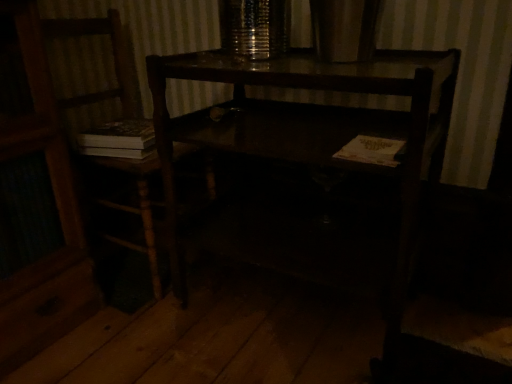
Question: Is wooden chair at left oriented away from white paper book at lower right?

Choices:
 (A) no
 (B) yes

Answer: (A)

Question: Is white paper book at lower right completely or partially inside wooden chair at left?

Choices:
 (A) yes
 (B) no

Answer: (B)

Question: From the image's perspective, is wooden chair at left over white paper book at lower right?

Choices:
 (A) no
 (B) yes

Answer: (B)

Question: Considering the relative positions of wooden chair at left and white paper book at lower right in the image provided, is wooden chair at left to the left of white paper book at lower right from the viewer's perspective?

Choices:
 (A) no
 (B) yes

Answer: (B)

Question: Is wooden chair at left touching white paper book at lower right?

Choices:
 (A) yes
 (B) no

Answer: (B)

Question: From a real-world perspective, does wooden chair at left stand above white paper book at lower right?

Choices:
 (A) no
 (B) yes

Answer: (A)

Question: From the image's perspective, would you say white paper book at lower right is shown under wooden chair at left?

Choices:
 (A) yes
 (B) no

Answer: (A)

Question: From a real-world perspective, is white paper book at lower right located higher than wooden chair at left?

Choices:
 (A) no
 (B) yes

Answer: (B)

Question: Is white paper book at lower right closer to the viewer compared to wooden chair at left?

Choices:
 (A) no
 (B) yes

Answer: (B)

Question: Does white paper book at lower right appear on the right side of wooden chair at left?

Choices:
 (A) no
 (B) yes

Answer: (B)

Question: Can you confirm if white paper book at lower right is bigger than wooden chair at left?

Choices:
 (A) no
 (B) yes

Answer: (A)

Question: Is wooden chair at left completely or partially inside white paper book at lower right?

Choices:
 (A) yes
 (B) no

Answer: (B)

Question: Can you see dark wood desk at center touching wooden chair at left?

Choices:
 (A) yes
 (B) no

Answer: (B)